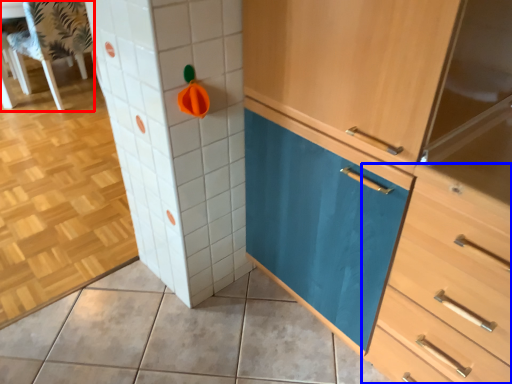
Question: Which of the following is the closest to the observer, chair (highlighted by a red box) or chest of drawers (highlighted by a blue box)?

Choices:
 (A) chair
 (B) chest of drawers

Answer: (B)